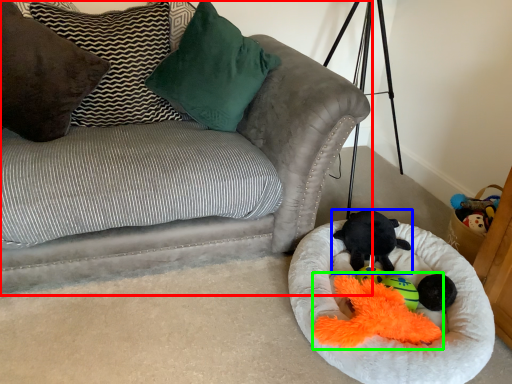
Question: Which is farther away from studio couch (highlighted by a red box)? toy (highlighted by a blue box) or miniature (highlighted by a green box)?

Choices:
 (A) toy
 (B) miniature

Answer: (B)